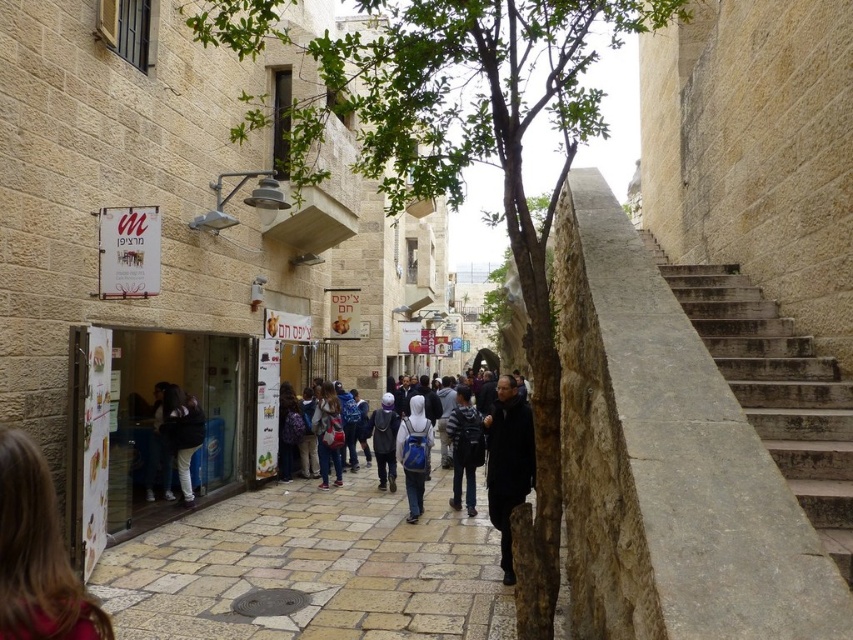
Question: Is green leafy tree at center positioned at the back of black matte jacket at center?

Choices:
 (A) yes
 (B) no

Answer: (B)

Question: Which of the following is the farthest from the observer?

Choices:
 (A) blue fabric backpack at center
 (B) green leafy tree at center

Answer: (A)

Question: Which of the following is the farthest from the observer?

Choices:
 (A) dark blue backpack at center
 (B) black matte jacket at center
 (C) blonde hair at lower left

Answer: (A)

Question: Is blonde hair at lower left below blue backpack at center?

Choices:
 (A) no
 (B) yes

Answer: (A)

Question: Which object appears closest to the camera in this image?

Choices:
 (A) light beige stone pavement at center
 (B) striped fabric backpack at center
 (C) dark blue backpack at center
 (D) blue fabric backpack at center

Answer: (A)

Question: Does light beige stone pavement at center have a greater width compared to blue fabric backpack at center?

Choices:
 (A) yes
 (B) no

Answer: (A)